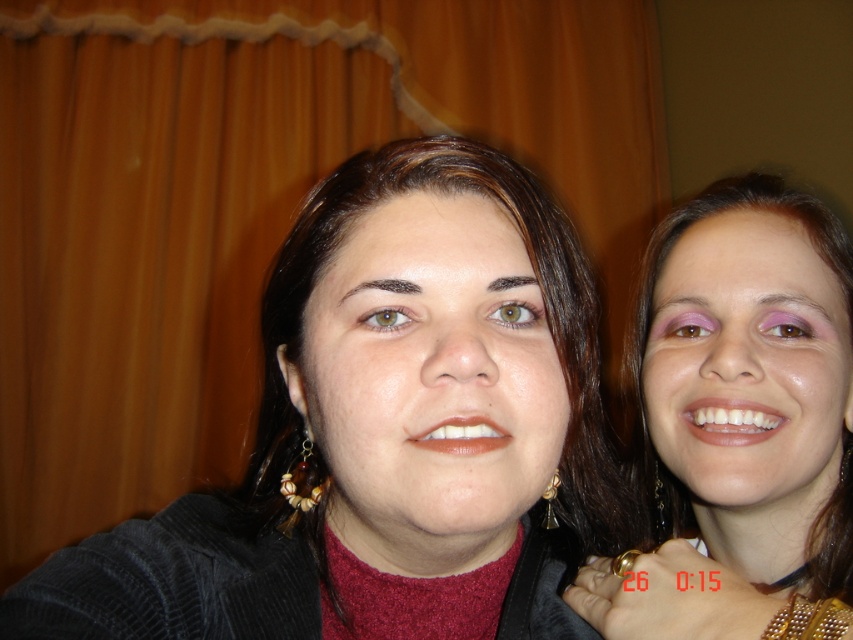
Question: Which of the following is the closest to the observer?

Choices:
 (A) matte black sweater at center
 (B) matte black hair at right

Answer: (A)

Question: Which point is closer to the camera taking this photo?

Choices:
 (A) (714, 488)
 (B) (506, 353)

Answer: (B)

Question: Is matte black sweater at center to the left of matte black hair at right from the viewer's perspective?

Choices:
 (A) no
 (B) yes

Answer: (B)

Question: Is matte black sweater at center to the right of matte black hair at right from the viewer's perspective?

Choices:
 (A) no
 (B) yes

Answer: (A)

Question: Which object is farther from the camera taking this photo?

Choices:
 (A) matte black sweater at center
 (B) matte black hair at right

Answer: (B)

Question: Can you confirm if matte black sweater at center is positioned to the right of matte black hair at right?

Choices:
 (A) no
 (B) yes

Answer: (A)